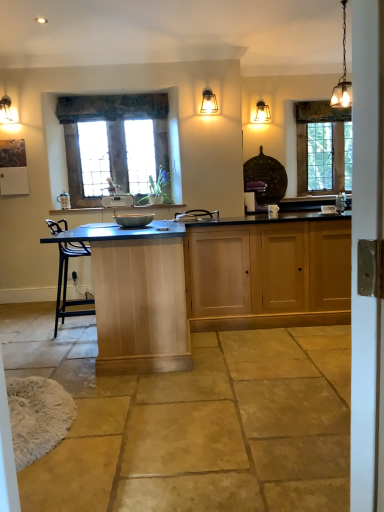
Question: Is textured fabric curtain at upper center smaller than stained glass window at upper right, marked as the 2th window in a left-to-right arrangement?

Choices:
 (A) yes
 (B) no

Answer: (A)

Question: Considering the relative sizes of textured fabric curtain at upper center and stained glass window at upper right, which ranks as the second window in front-to-back order, in the image provided, is textured fabric curtain at upper center shorter than stained glass window at upper right, which ranks as the second window in front-to-back order,?

Choices:
 (A) no
 (B) yes

Answer: (B)

Question: Is textured fabric curtain at upper center closer to camera compared to stained glass window at upper right, marked as the 2th window in a left-to-right arrangement?

Choices:
 (A) yes
 (B) no

Answer: (A)

Question: From the image's perspective, is textured fabric curtain at upper center on stained glass window at upper right, which ranks as the second window in front-to-back order?

Choices:
 (A) no
 (B) yes

Answer: (B)

Question: Is textured fabric curtain at upper center to the left of stained glass window at upper right, marked as the 2th window in a left-to-right arrangement, from the viewer's perspective?

Choices:
 (A) yes
 (B) no

Answer: (A)

Question: Is textured fabric curtain at upper center in contact with stained glass window at upper right, marked as the 2th window in a left-to-right arrangement?

Choices:
 (A) yes
 (B) no

Answer: (B)

Question: Is white glossy sink at center directly adjacent to metallic gray bowl at center, which is the second appliance from top to bottom?

Choices:
 (A) no
 (B) yes

Answer: (A)

Question: Can you confirm if white glossy sink at center is shorter than metallic gray bowl at center, acting as the 1th appliance starting from the right?

Choices:
 (A) no
 (B) yes

Answer: (A)

Question: Does white glossy sink at center contain metallic gray bowl at center, acting as the 1th appliance starting from the front?

Choices:
 (A) no
 (B) yes

Answer: (A)

Question: From a real-world perspective, is white glossy sink at center positioned under metallic gray bowl at center, marked as the second appliance in a left-to-right arrangement, based on gravity?

Choices:
 (A) yes
 (B) no

Answer: (B)

Question: Considering the relative sizes of white glossy sink at center and metallic gray bowl at center, which is the second appliance from top to bottom, in the image provided, is white glossy sink at center thinner than metallic gray bowl at center, which is the second appliance from top to bottom,?

Choices:
 (A) yes
 (B) no

Answer: (A)

Question: Can you confirm if white glossy sink at center is positioned to the left of metallic gray bowl at center, acting as the 1th appliance starting from the front?

Choices:
 (A) yes
 (B) no

Answer: (B)

Question: From the image's perspective, is textured fabric curtain at upper center located above metallic chain-link light fixture at upper right, arranged as the 3th light fixture when viewed from the back?

Choices:
 (A) yes
 (B) no

Answer: (A)